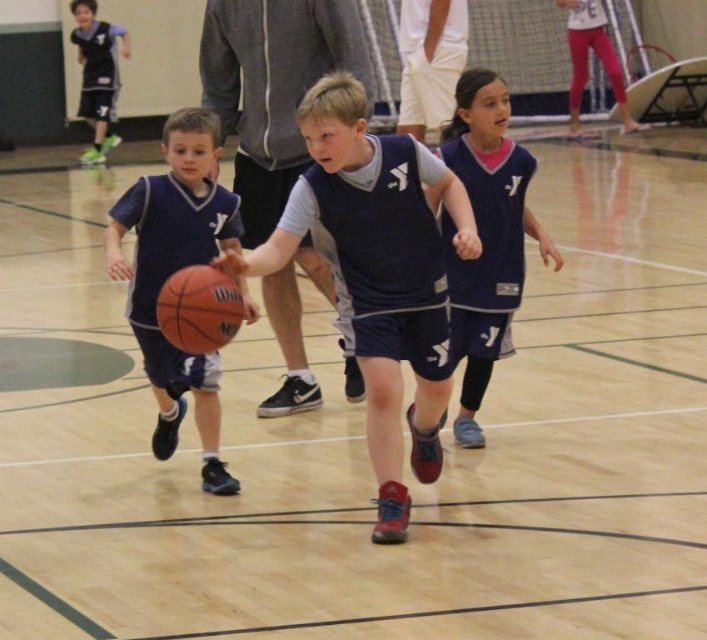
Can you confirm if rubber basketball at center is positioned to the right of rubber textured basketball at center?

Indeed, rubber basketball at center is positioned on the right side of rubber textured basketball at center.

Can you confirm if rubber basketball at center is positioned below rubber textured basketball at center?

Incorrect, rubber basketball at center is not positioned below rubber textured basketball at center.

Looking at this image, who is more distant from viewer, (312, 173) or (165, 280)?

The point (165, 280) is behind.

Where is `rubber basketball at center`? rubber basketball at center is located at coordinates (366, 246).

In the scene shown: Between matte blue jersey at left and navy blue jersey at center, which one has less height?

matte blue jersey at left is shorter.

Can you confirm if matte blue jersey at left is smaller than navy blue jersey at center?

Indeed, matte blue jersey at left has a smaller size compared to navy blue jersey at center.

Between point (228, 211) and point (515, 202), which one is positioned behind?

Point (515, 202)

Where is `matte blue jersey at left`? This screenshot has height=640, width=707. matte blue jersey at left is located at coordinates (175, 272).

Which is behind, point (445, 81) or point (99, 104)?

The point (99, 104) is more distant.

Describe the element at coordinates (431, 61) in the screenshot. This screenshot has height=640, width=707. I see `white cotton pants at upper center` at that location.

The image size is (707, 640). I want to click on white cotton pants at upper center, so click(431, 61).